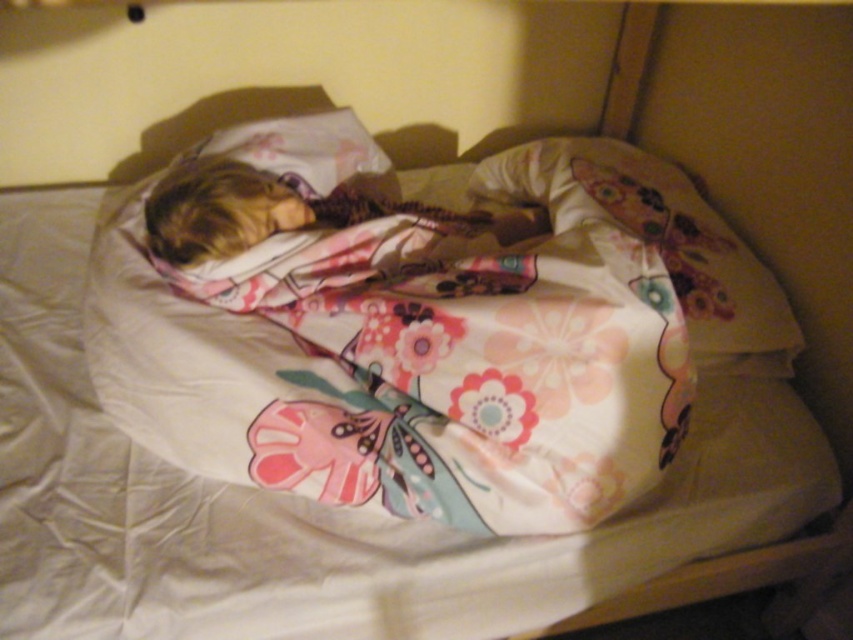
Is floral fabric pillow at center positioned behind fluffy pink blanket at center?

No, floral fabric pillow at center is closer to the viewer.

In the scene shown: Is floral fabric pillow at center below fluffy pink blanket at center?

Yes, floral fabric pillow at center is below fluffy pink blanket at center.

Is point (711, 205) more distant than point (258, 212)?

Yes, point (711, 205) is behind point (258, 212).

Image resolution: width=853 pixels, height=640 pixels. Find the location of `floral fabric pillow at center`. floral fabric pillow at center is located at coordinates (656, 240).

Is floral fabric blanket at center thinner than floral fabric pillow at center?

Incorrect, floral fabric blanket at center's width is not less than floral fabric pillow at center's.

Is floral fabric blanket at center closer to camera compared to floral fabric pillow at center?

Yes, floral fabric blanket at center is in front of floral fabric pillow at center.

The width and height of the screenshot is (853, 640). What do you see at coordinates (415, 364) in the screenshot?
I see `floral fabric blanket at center` at bounding box center [415, 364].

Where is `floral fabric blanket at center`? The image size is (853, 640). floral fabric blanket at center is located at coordinates (415, 364).

Who is taller, floral fabric blanket at center or fluffy pink blanket at center?

With more height is floral fabric blanket at center.

Can you confirm if floral fabric blanket at center is bigger than fluffy pink blanket at center?

Yes.

Find the location of `floral fabric blanket at center`. floral fabric blanket at center is located at coordinates (415, 364).